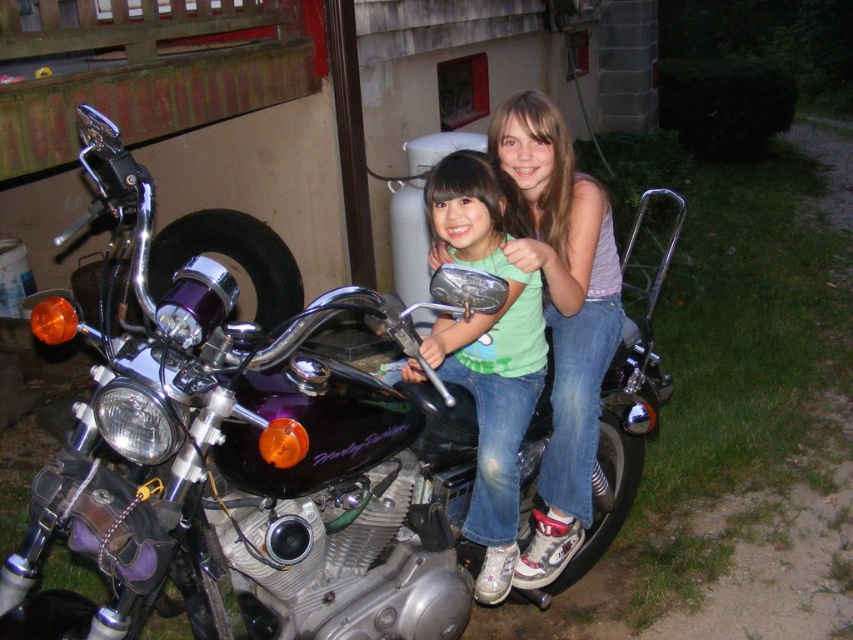
Question: Which point is closer to the camera taking this photo?

Choices:
 (A) (82, 227)
 (B) (593, 208)

Answer: (B)

Question: Is shiny purple motorcycle at center to the right of denim jeans at center from the viewer's perspective?

Choices:
 (A) no
 (B) yes

Answer: (A)

Question: Which point is farther to the camera?

Choices:
 (A) denim jeans at center
 (B) shiny purple motorcycle at center

Answer: (A)

Question: Which object appears farthest from the camera in this image?

Choices:
 (A) green matte shirt at center
 (B) shiny purple motorcycle at center

Answer: (A)

Question: From the image, what is the correct spatial relationship of shiny purple motorcycle at center in relation to green matte shirt at center?

Choices:
 (A) below
 (B) above

Answer: (A)

Question: Can you confirm if shiny purple motorcycle at center is positioned above denim jeans at center?

Choices:
 (A) no
 (B) yes

Answer: (A)